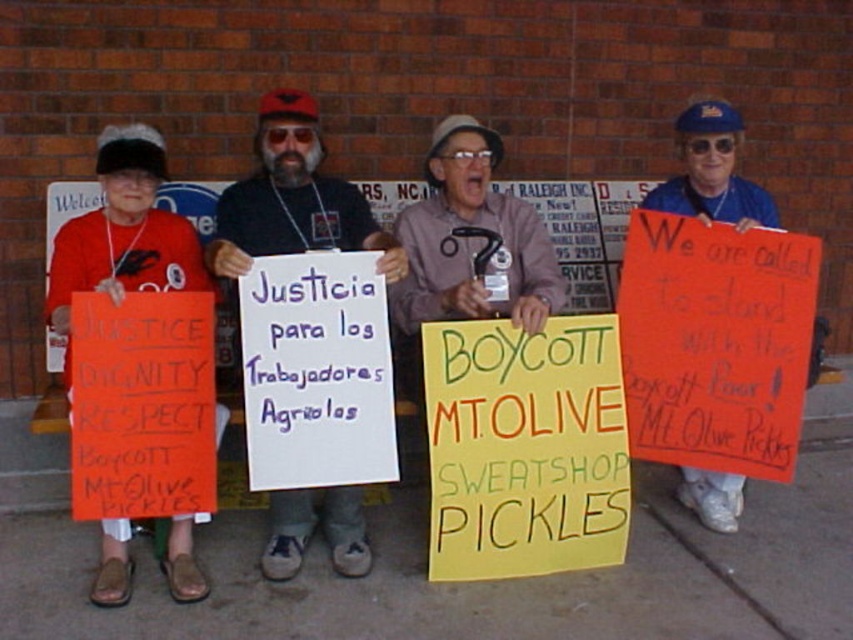
You are standing 5 feet away from the point at coordinates (554, 404). Is the point closer to you or farther away than your current position?

The point at coordinates (554, 404) is 9.64 feet away from the camera, so if you are standing 5 feet away, the point is farther away than your current position.

From the picture: You are a photographer standing at the edge of the protest area. You want to take a photo that includes both the concrete pavement at lower center and the yellow paper sign at center. Based on their positions, which object should appear closer to the camera in the photo?

The concrete pavement at lower center is in front of the yellow paper sign at center, so it will appear closer to the camera in the photo.